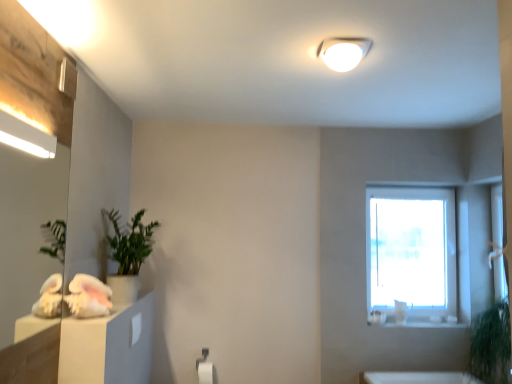
Question: Can you confirm if white matte toilet paper at lower center is bigger than green matte plant at left?

Choices:
 (A) no
 (B) yes

Answer: (A)

Question: Are white matte toilet paper at lower center and green matte plant at left far apart?

Choices:
 (A) no
 (B) yes

Answer: (B)

Question: Is white matte toilet paper at lower center positioned behind green matte plant at left?

Choices:
 (A) yes
 (B) no

Answer: (A)

Question: Is white matte toilet paper at lower center with green matte plant at left?

Choices:
 (A) no
 (B) yes

Answer: (A)

Question: Is green matte plant at left at the back of white matte toilet paper at lower center?

Choices:
 (A) no
 (B) yes

Answer: (A)

Question: Can you confirm if white matte toilet paper at lower center is thinner than green matte plant at left?

Choices:
 (A) no
 (B) yes

Answer: (B)

Question: Is white matte toilet paper at lower center not close to matte white drawer at lower left?

Choices:
 (A) no
 (B) yes

Answer: (A)

Question: From the image's perspective, is white matte toilet paper at lower center located above matte white drawer at lower left?

Choices:
 (A) yes
 (B) no

Answer: (B)

Question: Considering the relative sizes of white matte toilet paper at lower center and matte white drawer at lower left in the image provided, is white matte toilet paper at lower center taller than matte white drawer at lower left?

Choices:
 (A) no
 (B) yes

Answer: (B)

Question: Considering the relative sizes of white matte toilet paper at lower center and matte white drawer at lower left in the image provided, is white matte toilet paper at lower center thinner than matte white drawer at lower left?

Choices:
 (A) no
 (B) yes

Answer: (A)

Question: Is white matte toilet paper at lower center closer to camera compared to matte white drawer at lower left?

Choices:
 (A) yes
 (B) no

Answer: (B)

Question: From a real-world perspective, is white matte toilet paper at lower center beneath matte white drawer at lower left?

Choices:
 (A) no
 (B) yes

Answer: (B)

Question: Considering the relative sizes of green leafy plant at lower right and matte wooden mirror at left in the image provided, is green leafy plant at lower right smaller than matte wooden mirror at left?

Choices:
 (A) yes
 (B) no

Answer: (B)